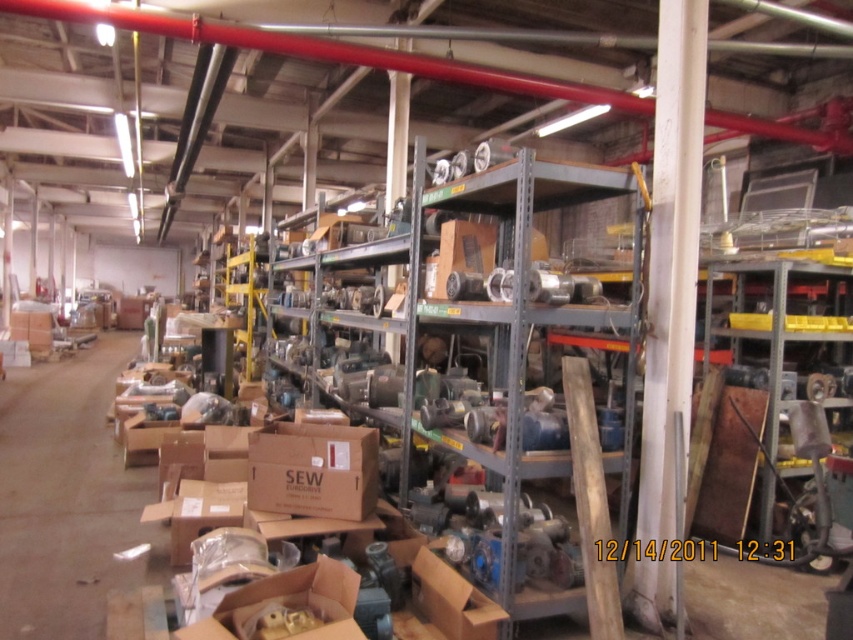
You are a warehouse worker who needs to retrieve a part from the metallic gray shelf at center. However, there is a brown cardboard box at center in the way. Can you access the shelf without moving the box?

The metallic gray shelf at center is positioned over the brown cardboard box at center, so you can access the shelf without needing to move the box since it is above the box.

You are a warehouse worker who needs to move a 20 inch wide box from the white painted wood at right to the metallic gray shelf at center. Can you slide the box between them without tilting it?

The white painted wood at right and metallic gray shelf at center are 21.57 inches apart from each other. Since the box is 20 inches wide, there is enough space to slide it between them without tilting.

You are a warehouse worker who needs to move a 5 feet long ladder from the entrance to the storage area. You see the white painted wood at right and the brown cardboard box at center. Can you safely carry the ladder horizontally between them without hitting anything?

The white painted wood at right is 4.92 feet away from the brown cardboard box at center. Since the ladder is 5 feet long, the distance between them is slightly less than the ladder length. Therefore, you cannot safely carry the ladder horizontally between them without risking a collision.